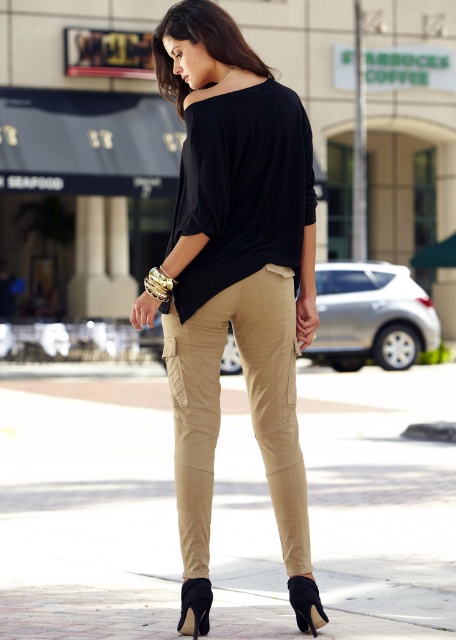
Question: Is black suede sandal at lower center below black suede sandal at lower right?

Choices:
 (A) yes
 (B) no

Answer: (B)

Question: Is matte khaki pants at center below tan/cotton cargo pants at center?

Choices:
 (A) no
 (B) yes

Answer: (A)

Question: Can you confirm if matte khaki pants at center is smaller than black suede sandal at lower right?

Choices:
 (A) no
 (B) yes

Answer: (A)

Question: Which of the following is the farthest from the observer?

Choices:
 (A) coord(162,284)
 (B) coord(284,486)
 (C) coord(196,611)

Answer: (B)

Question: Which of the following is the farthest from the observer?

Choices:
 (A) black suede sandal at lower center
 (B) black suede sandal at lower right
 (C) tan/cotton cargo pants at center

Answer: (C)

Question: Which point appears farthest from the camera in this image?

Choices:
 (A) (260, 442)
 (B) (205, 628)
 (C) (316, 593)

Answer: (A)